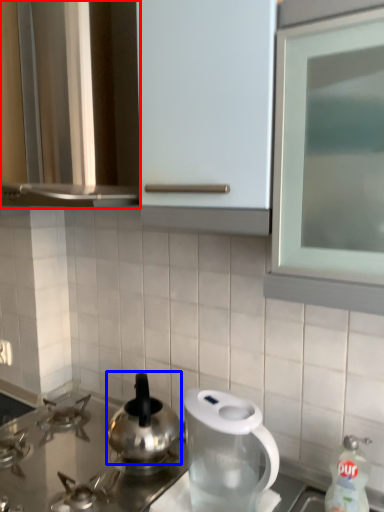
Question: Which object appears closest to the camera in this image, cabinetry (highlighted by a red box) or kitchen appliance (highlighted by a blue box)?

Choices:
 (A) cabinetry
 (B) kitchen appliance

Answer: (A)